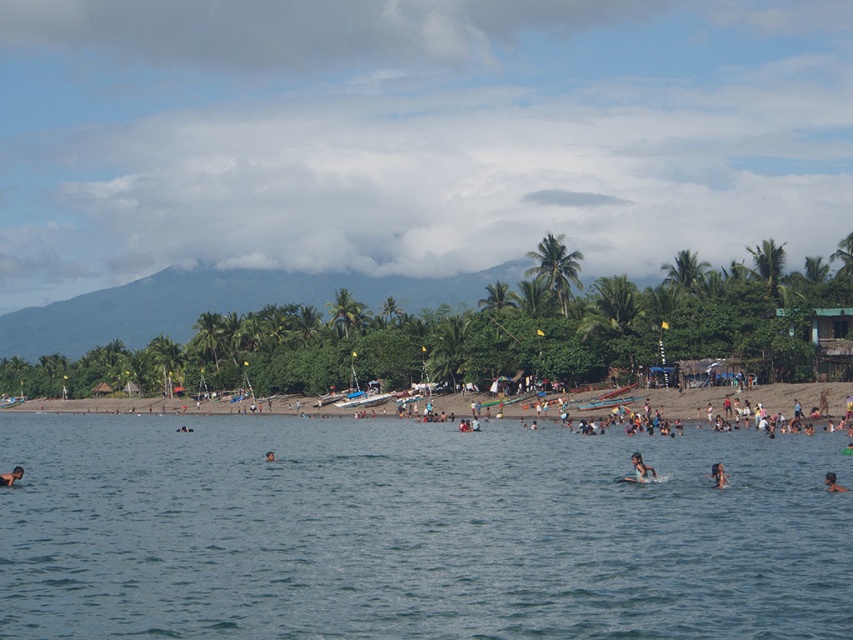
Question: Among these objects, which one is nearest to the camera?

Choices:
 (A) dark brown skin at lower left
 (B) smooth skin person at center
 (C) dark blue swimwear at center
 (D) brown hair at center

Answer: (B)

Question: Is blue water at center smaller than dark brown skin at lower left?

Choices:
 (A) no
 (B) yes

Answer: (A)

Question: Which point appears farthest from the camera in this image?

Choices:
 (A) (828, 488)
 (B) (187, 429)
 (C) (270, 456)

Answer: (B)

Question: Is smooth skin person at center positioned behind smooth skin head at lower right?

Choices:
 (A) no
 (B) yes

Answer: (B)

Question: Which point appears closest to the camera in this image?

Choices:
 (A) (718, 468)
 (B) (183, 428)

Answer: (A)

Question: Does brown textured surfboard at center appear over brown hair at center?

Choices:
 (A) yes
 (B) no

Answer: (A)